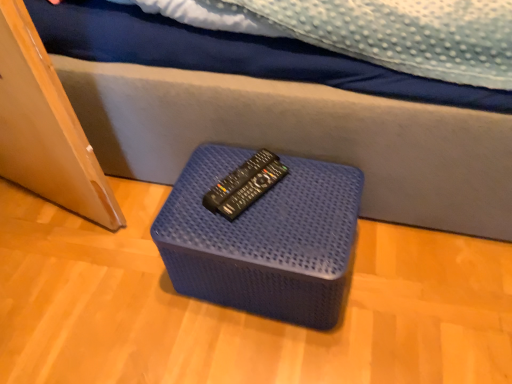
The width and height of the screenshot is (512, 384). Identify the location of unoccupied space behind black plastic remote at center. (229, 153).